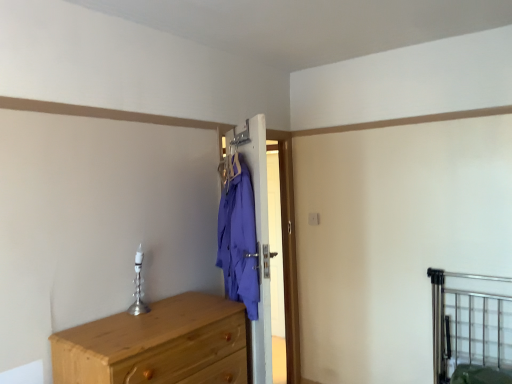
Question: In terms of width, does metallic silver bed frame at lower right look wider or thinner when compared to light brown wooden chest of drawers at lower left?

Choices:
 (A) thin
 (B) wide

Answer: (A)

Question: Is metallic silver bed frame at lower right taller or shorter than light brown wooden chest of drawers at lower left?

Choices:
 (A) short
 (B) tall

Answer: (B)

Question: Do you think metallic silver bed frame at lower right is within light brown wooden chest of drawers at lower left, or outside of it?

Choices:
 (A) inside
 (B) outside

Answer: (B)

Question: Considering their positions, is light brown wooden chest of drawers at lower left located in front of or behind metallic silver bed frame at lower right?

Choices:
 (A) front
 (B) behind

Answer: (A)

Question: In terms of height, does light brown wooden chest of drawers at lower left look taller or shorter compared to metallic silver bed frame at lower right?

Choices:
 (A) tall
 (B) short

Answer: (B)

Question: Is light brown wooden chest of drawers at lower left inside or outside of metallic silver bed frame at lower right?

Choices:
 (A) outside
 (B) inside

Answer: (A)

Question: Is light brown wooden chest of drawers at lower left bigger or smaller than metallic silver bed frame at lower right?

Choices:
 (A) small
 (B) big

Answer: (B)